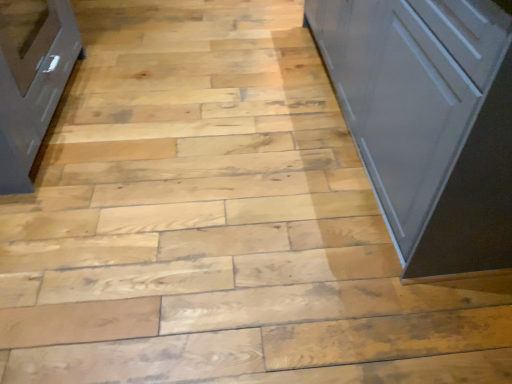
Question: From a real-world perspective, does white glossy cupboard at right sit lower than matte gray cabinet at left?

Choices:
 (A) no
 (B) yes

Answer: (A)

Question: Can you confirm if white glossy cupboard at right is wider than matte gray cabinet at left?

Choices:
 (A) yes
 (B) no

Answer: (A)

Question: From a real-world perspective, is white glossy cupboard at right positioned over matte gray cabinet at left based on gravity?

Choices:
 (A) yes
 (B) no

Answer: (A)

Question: Is white glossy cupboard at right facing away from matte gray cabinet at left?

Choices:
 (A) yes
 (B) no

Answer: (A)

Question: Are white glossy cupboard at right and matte gray cabinet at left making contact?

Choices:
 (A) yes
 (B) no

Answer: (B)

Question: Can you confirm if white glossy cupboard at right is thinner than matte gray cabinet at left?

Choices:
 (A) no
 (B) yes

Answer: (A)

Question: Is matte gray cabinet at left positioned before white glossy cupboard at right?

Choices:
 (A) no
 (B) yes

Answer: (A)

Question: Considering the relative sizes of matte gray cabinet at left and white glossy cupboard at right in the image provided, is matte gray cabinet at left wider than white glossy cupboard at right?

Choices:
 (A) no
 (B) yes

Answer: (A)

Question: Would you say white glossy cupboard at right is part of matte gray cabinet at left's contents?

Choices:
 (A) yes
 (B) no

Answer: (B)

Question: Is matte gray cabinet at left with white glossy cupboard at right?

Choices:
 (A) yes
 (B) no

Answer: (B)

Question: Would you say matte gray cabinet at left is outside white glossy cupboard at right?

Choices:
 (A) no
 (B) yes

Answer: (B)

Question: From the image's perspective, does matte gray cabinet at left appear lower than white glossy cupboard at right?

Choices:
 (A) no
 (B) yes

Answer: (B)

Question: Is white glossy cupboard at right wider or thinner than matte gray cabinet at left?

Choices:
 (A) wide
 (B) thin

Answer: (A)